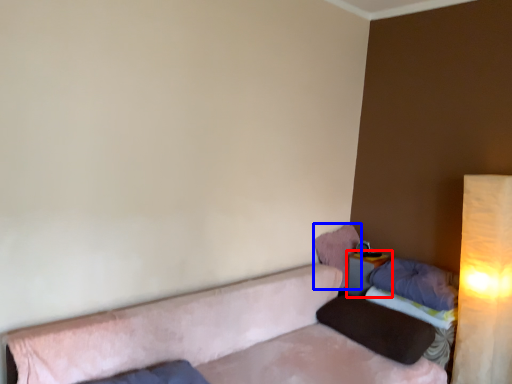
Question: Which object is further to the camera taking this photo, table (highlighted by a red box) or pillow (highlighted by a blue box)?

Choices:
 (A) table
 (B) pillow

Answer: (B)